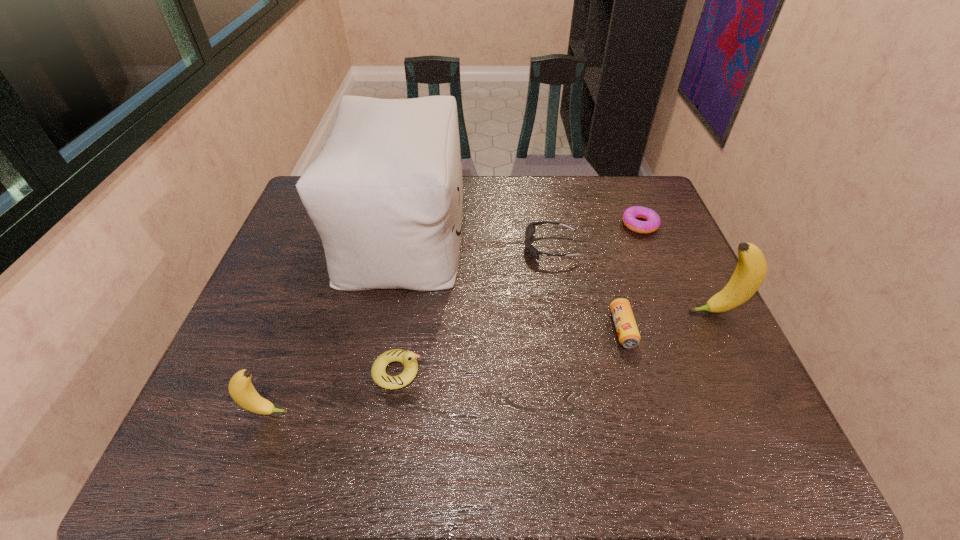
What are the coordinates of `free region located 0.370m from the stem of the shorter banana` in the screenshot? It's located at (467, 413).

Where is `free space located 0.230m from the stem of the sixth shortest object`? The height and width of the screenshot is (540, 960). free space located 0.230m from the stem of the sixth shortest object is located at coordinates (598, 312).

Where is `vacant space situated 0.250m from the stem of the sixth shortest object`? vacant space situated 0.250m from the stem of the sixth shortest object is located at coordinates (589, 312).

I want to click on free space located 0.270m from the stem of the sixth shortest object, so click(x=582, y=312).

Where is `free space located 0.180m on the side of the tallest object with the smiley face`? free space located 0.180m on the side of the tallest object with the smiley face is located at coordinates (523, 233).

Where is `free space located 0.310m on the lenses of the goggles`? free space located 0.310m on the lenses of the goggles is located at coordinates (418, 247).

Find the location of a particular element. vacant area located 0.170m on the lenses of the goggles is located at coordinates (466, 247).

Where is `vacant area situated 0.180m on the lenses of the goggles`? This screenshot has height=540, width=960. vacant area situated 0.180m on the lenses of the goggles is located at coordinates (462, 247).

Locate an element on the screen. The image size is (960, 540). vacant region located on the left of the shortest object is located at coordinates (583, 225).

Identify the location of free region located 0.180m on the face of the duckling. This screenshot has height=540, width=960. (503, 372).